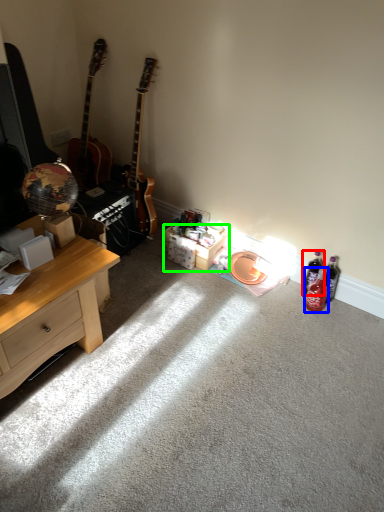
Question: Considering the real-world distances, which object is farthest from bottle (highlighted by a red box)? bottle (highlighted by a blue box) or box (highlighted by a green box)?

Choices:
 (A) bottle
 (B) box

Answer: (B)